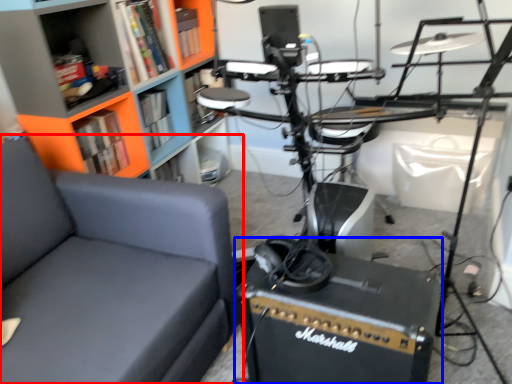
Question: Which object appears farthest to the camera in this image, chair (highlighted by a red box) or equipment (highlighted by a blue box)?

Choices:
 (A) chair
 (B) equipment

Answer: (B)